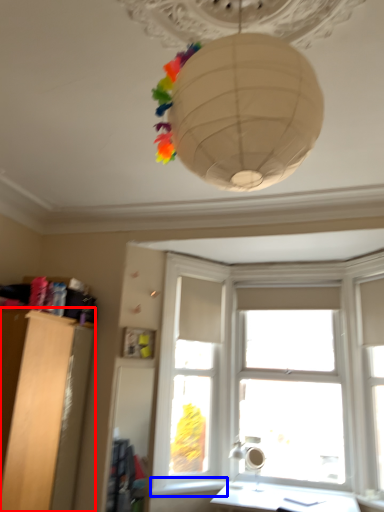
Question: Which of the following is the closest to the observer, furniture (highlighted by a red box) or window sill (highlighted by a blue box)?

Choices:
 (A) furniture
 (B) window sill

Answer: (A)